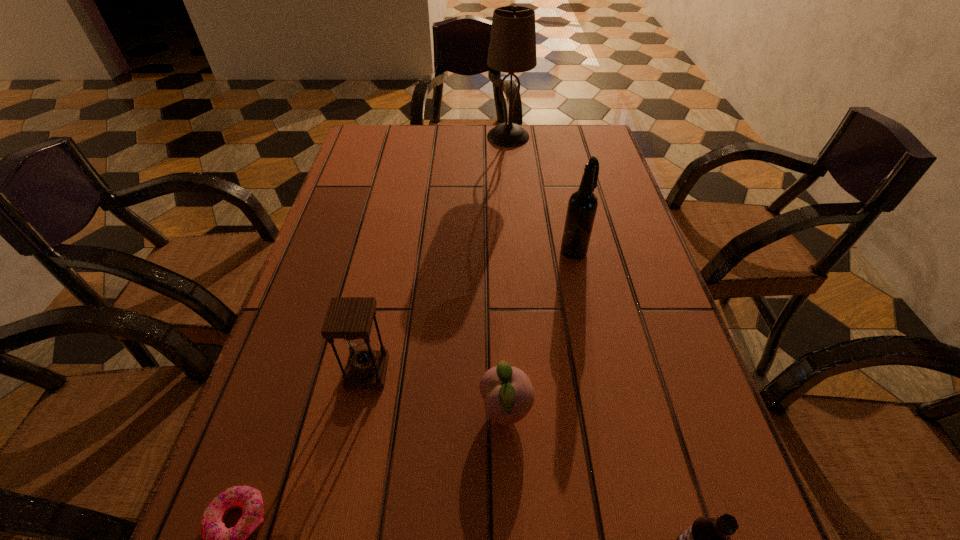
In order to click on vacant area that satisfies the following two spatial constraints: 1. on the front-facing side of the lampshade; 2. on the front side of the peach in this screenshot , I will do `click(533, 410)`.

Where is `free space that satisfies the following two spatial constraints: 1. on the front side of the fifth object from right to left; 2. on the left side of the peach`? The image size is (960, 540). free space that satisfies the following two spatial constraints: 1. on the front side of the fifth object from right to left; 2. on the left side of the peach is located at coordinates (359, 410).